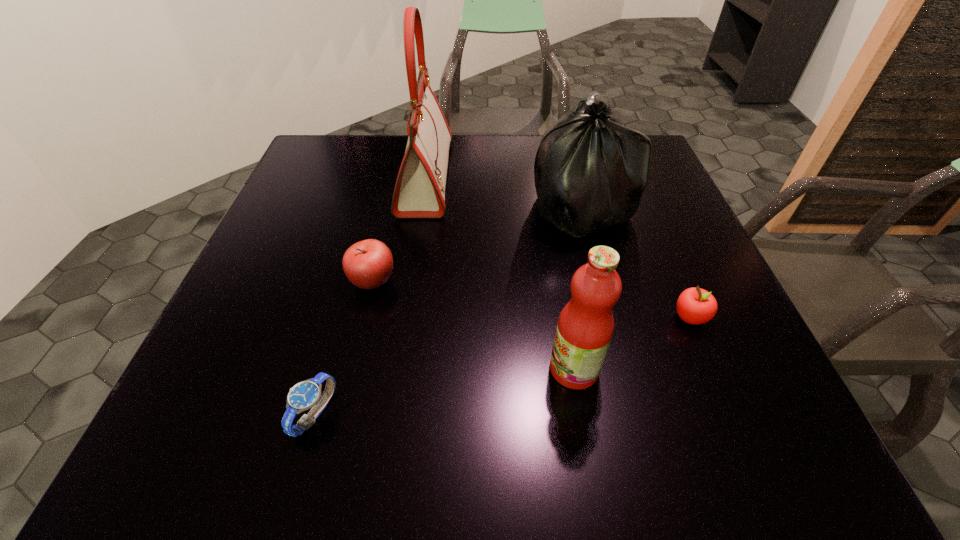
At what (x,y) coordinates should I click in order to perform the action: click on free location located 0.230m on the front label of the fruit juice. Please return your answer as a coordinate pair (x, y). Looking at the image, I should click on [x=418, y=369].

The image size is (960, 540). I want to click on free spot located on the front label of the fruit juice, so 487,369.

Find the location of a particular element. This screenshot has width=960, height=540. blank space located on the front label of the fruit juice is located at coordinates (464, 369).

Identify the location of free space located 0.370m on the right of the taller apple. The image size is (960, 540). (574, 282).

Locate an element on the screen. Image resolution: width=960 pixels, height=540 pixels. vacant space located 0.250m on the back of the second shortest object is located at coordinates (651, 224).

Identify the location of vacant space located on the right of the shortest object. The height and width of the screenshot is (540, 960). (432, 414).

Where is `handbag that is at the far edge`? The image size is (960, 540). handbag that is at the far edge is located at coordinates pos(419,192).

Locate an element on the screen. plastic bag that is at the far edge is located at coordinates (590, 171).

This screenshot has height=540, width=960. In order to click on object that is at the near edge in this screenshot , I will do pyautogui.click(x=305, y=395).

This screenshot has width=960, height=540. Find the location of `plastic bag situated at the right edge`. plastic bag situated at the right edge is located at coordinates (590, 171).